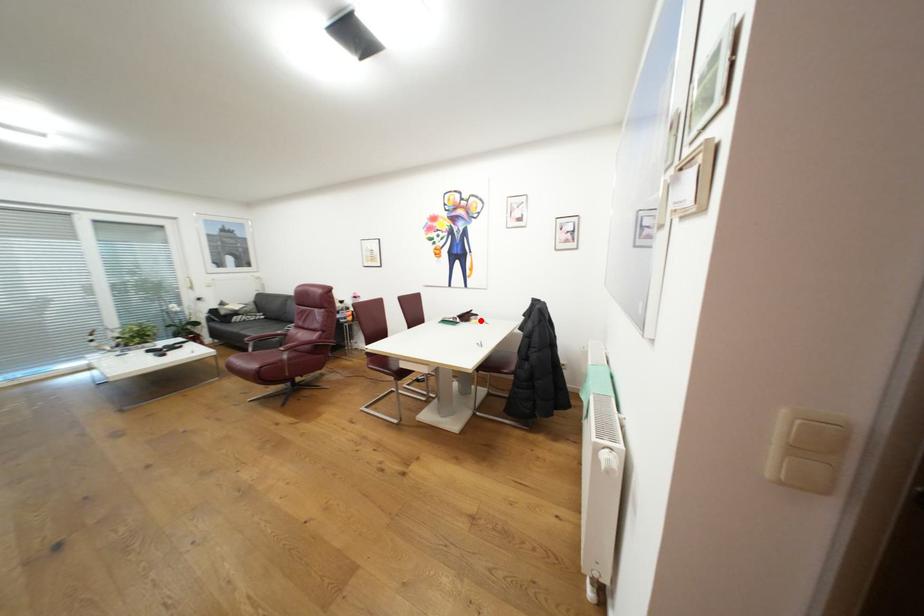
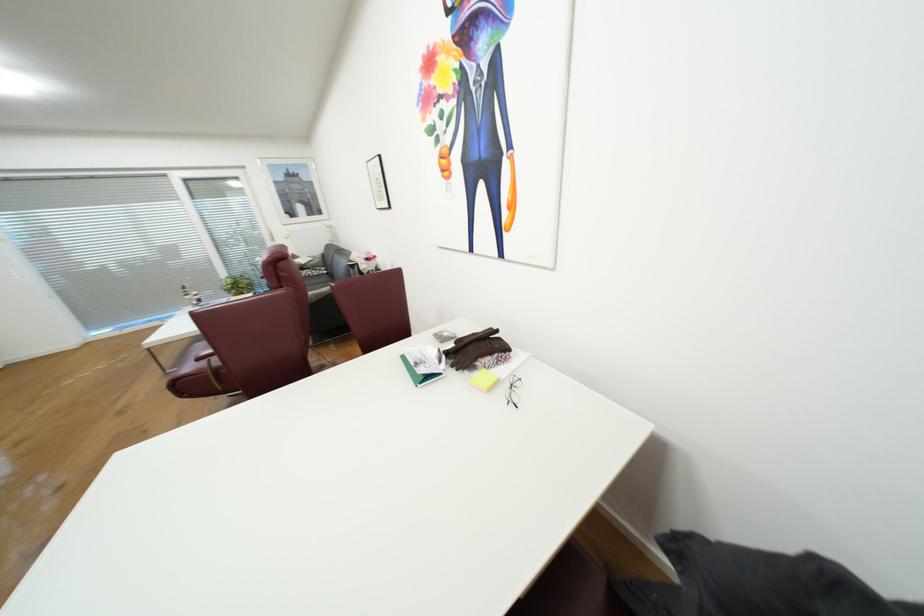
Find the pixel in the second image that matches the highlighted location in the first image.

(492, 373)